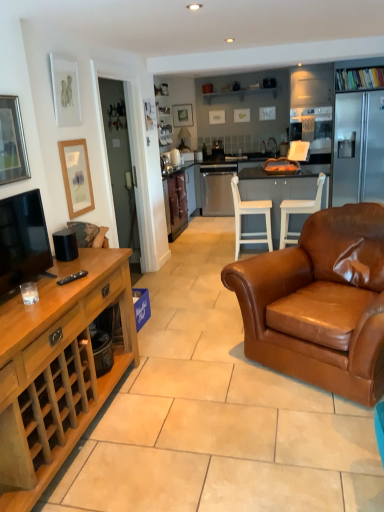
Where is `vacant region to the right of wooden cabinet at left, which ranks as the 2th cabinetry in top-to-bottom order`? This screenshot has height=512, width=384. vacant region to the right of wooden cabinet at left, which ranks as the 2th cabinetry in top-to-bottom order is located at coordinates (200, 440).